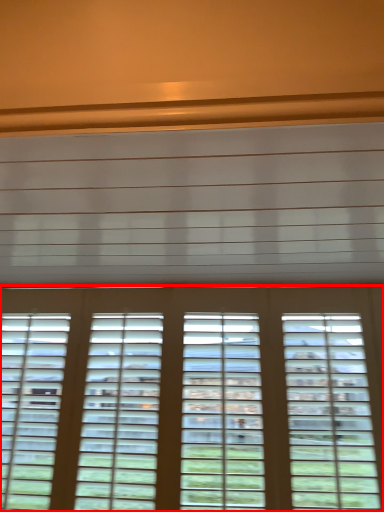
Question: From the image's perspective, what is the correct spatial relationship of window (annotated by the red box) in relation to blind?

Choices:
 (A) above
 (B) below

Answer: (B)